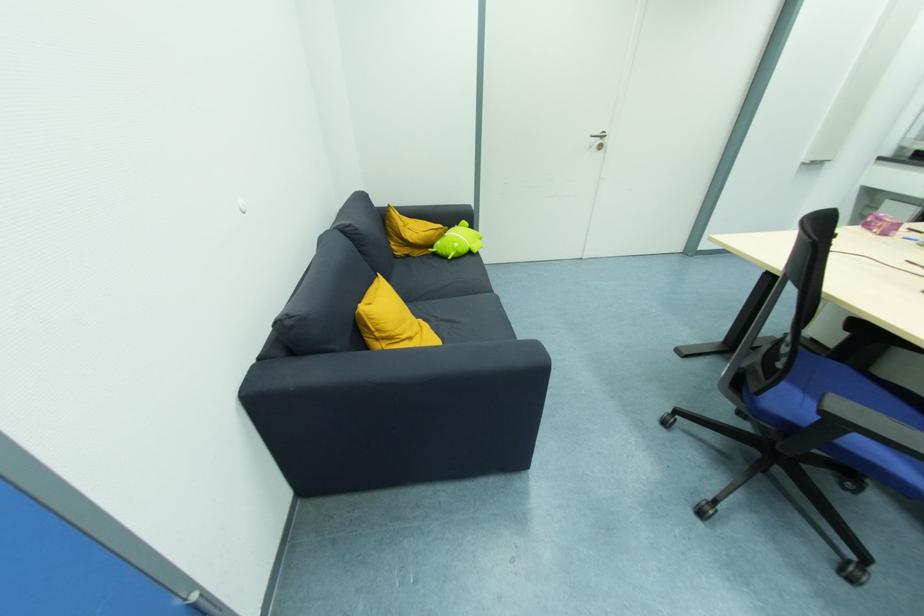
This screenshot has height=616, width=924. Identify the location of chair armrest. (871, 424).